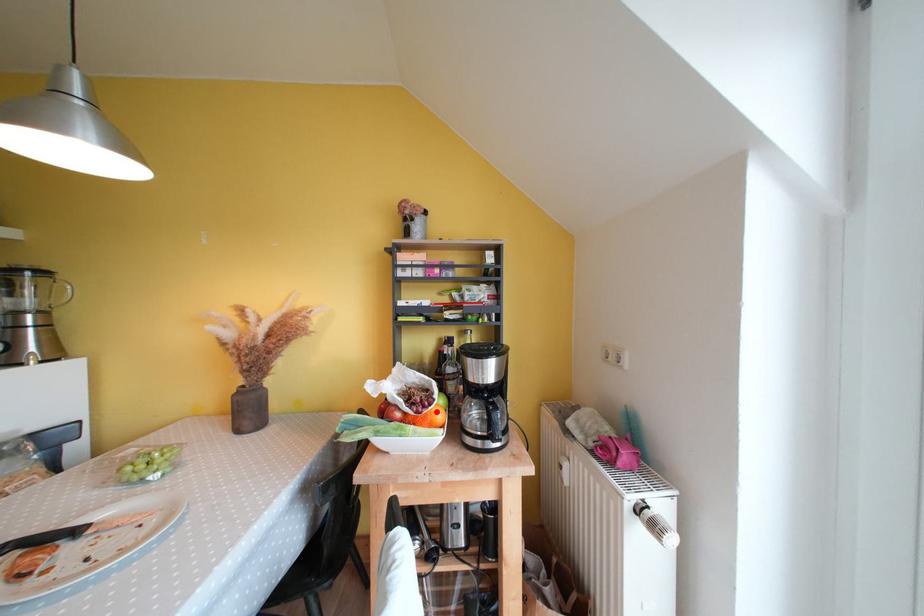
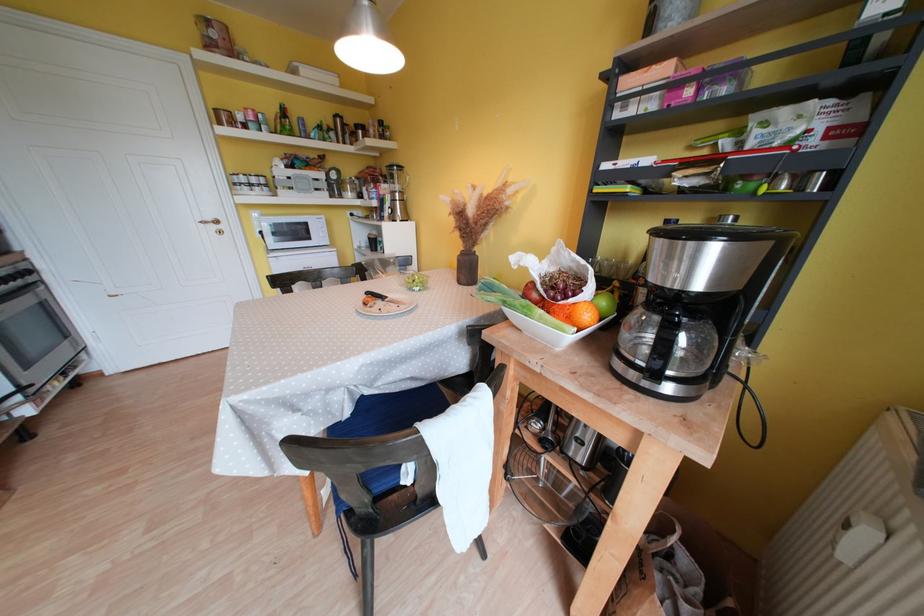
Locate, in the second image, the point that corresponds to the highlighted location in the first image.

(578, 302)